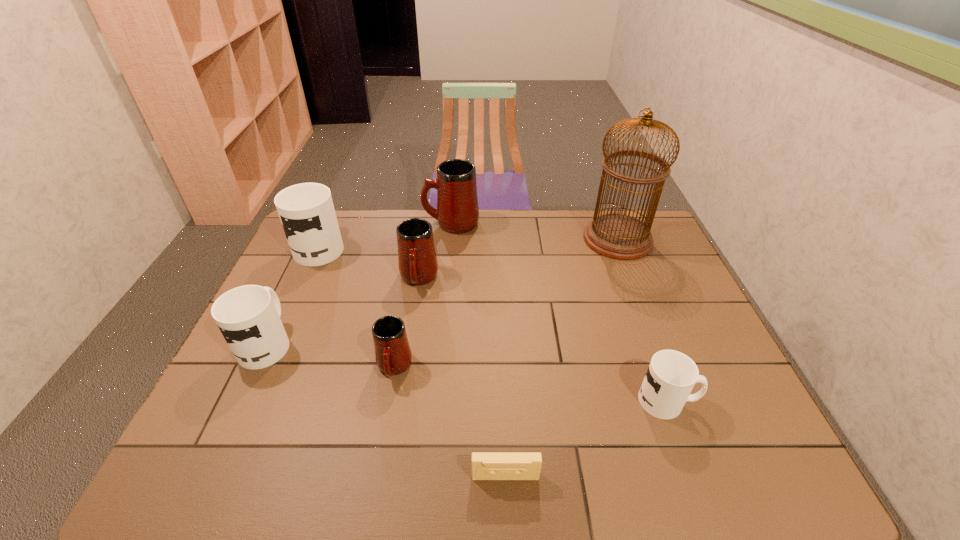
Where is `white mug object that ranks as the second closest to the videotape`? This screenshot has width=960, height=540. white mug object that ranks as the second closest to the videotape is located at coordinates (248, 316).

Identify which white mug is located as the second nearest to the farthest red mug. Please provide its 2D coordinates. Your answer should be formatted as a tuple, i.e. [(x, y)], where the tuple contains the x and y coordinates of a point satisfying the conditions above.

[(248, 316)]

Find the location of a particular element. Image resolution: width=960 pixels, height=540 pixels. free region that satisfies the following two spatial constraints: 1. on the side of the biggest red mug with the handle; 2. on the side of the smallest red mug with the handle is located at coordinates (439, 367).